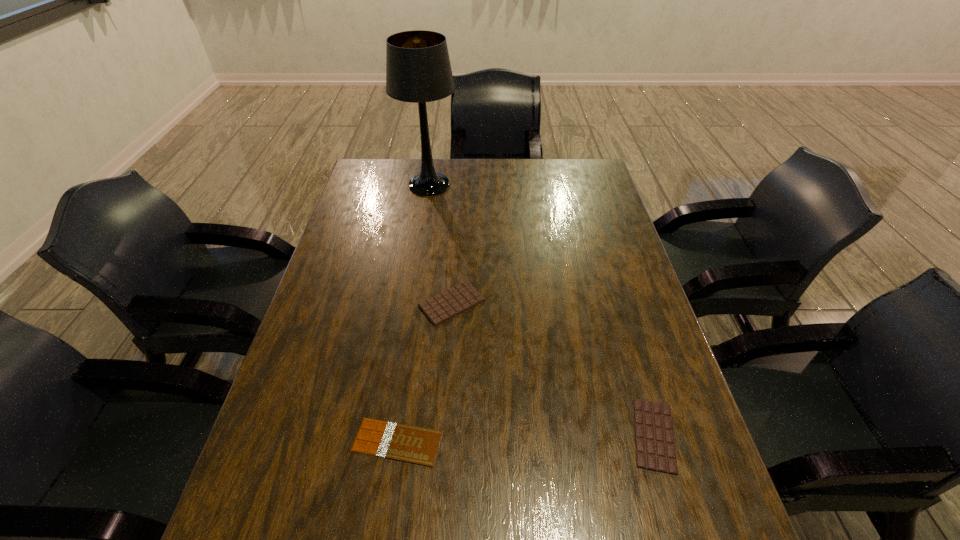
Identify which object is the third nearest to the rightmost object. Please provide its 2D coordinates. Your answer should be formatted as a tuple, i.e. [(x, y)], where the tuple contains the x and y coordinates of a point satisfying the conditions above.

[(418, 70)]

Point out which chocolate bar is positioned as the nearest to the third shortest object. Please provide its 2D coordinates. Your answer should be formatted as a tuple, i.e. [(x, y)], where the tuple contains the x and y coordinates of a point satisfying the conditions above.

[(396, 441)]

Locate an element on the screen. This screenshot has height=540, width=960. chocolate bar that is the second closest to the table lamp is located at coordinates (396, 441).

Find the location of a particular element. The height and width of the screenshot is (540, 960). blank space that satisfies the following two spatial constraints: 1. on the front side of the shortest object; 2. on the left side of the table lamp is located at coordinates (391, 442).